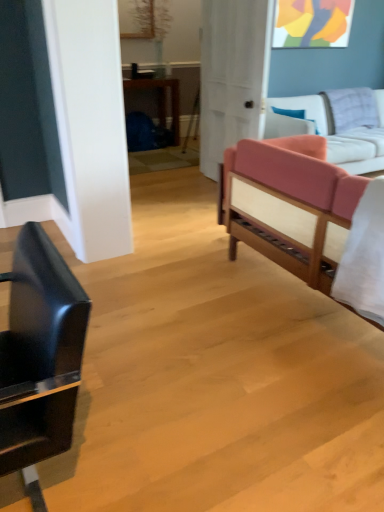
Locate an element on the screen. The image size is (384, 512). blank area beneath shiny black chair at left (from a real-world perspective) is located at coordinates (58, 490).